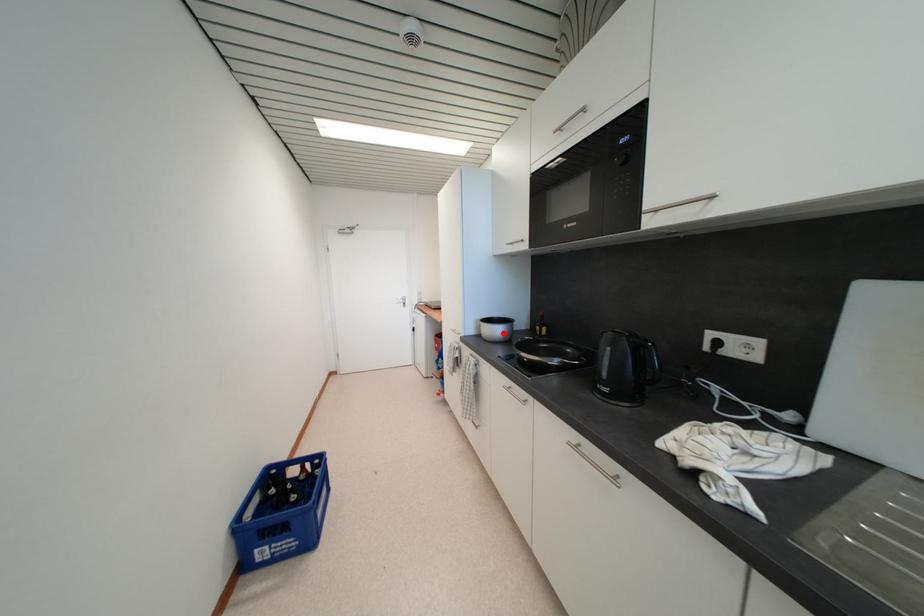
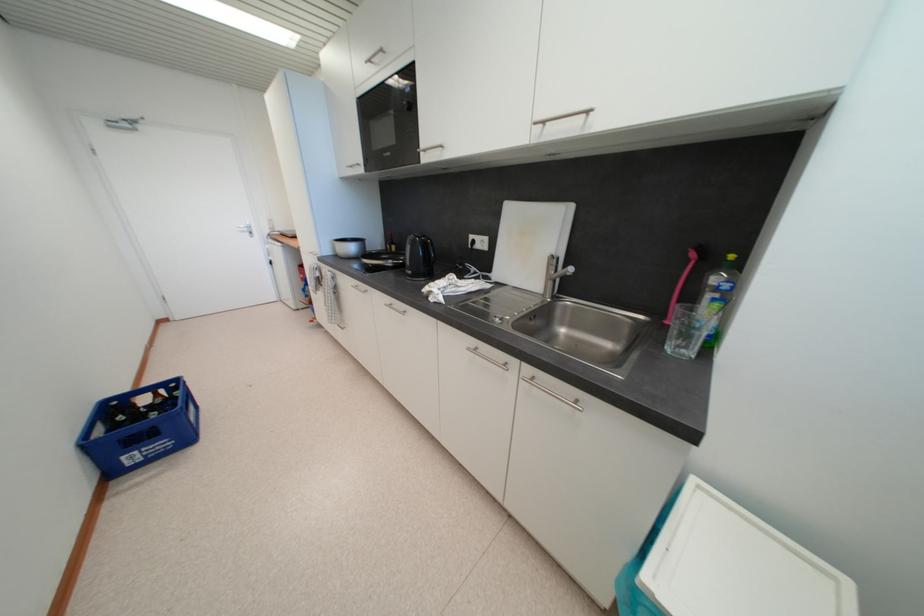
The point at the highlighted location is marked in the first image. Where is the corresponding point in the second image?

(357, 251)